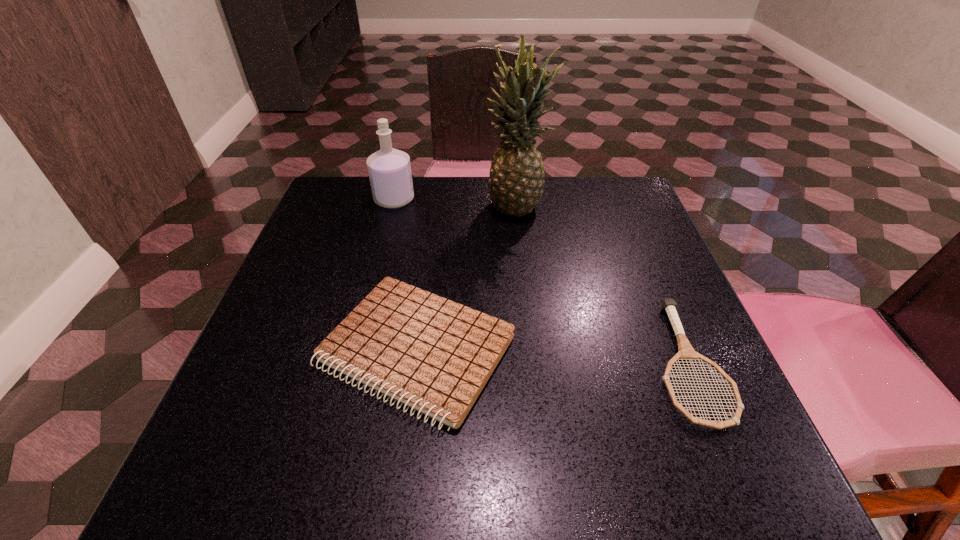
You are a GUI agent. You are given a task and a screenshot of the screen. Output one action in this format:
    pyautogui.click(x=<x>, y=<y>)
    Task: Click on the vacant point located between the rightmost object and the pineapple
    
    Given the screenshot: What is the action you would take?
    pyautogui.click(x=602, y=284)

Locate which object ranks third in proximity to the tennis racket. Please provide its 2D coordinates. Your answer should be formatted as a tuple, i.e. [(x, y)], where the tuple contains the x and y coordinates of a point satisfying the conditions above.

[(389, 169)]

This screenshot has width=960, height=540. In order to click on the second closest object relative to the notebook in this screenshot , I will do `click(686, 352)`.

The width and height of the screenshot is (960, 540). I want to click on free spot that satisfies the following two spatial constraints: 1. on the front side of the notebook; 2. on the right side of the rightmost object, so click(x=415, y=363).

Locate an element on the screen. The image size is (960, 540). free spot that satisfies the following two spatial constraints: 1. on the front side of the perfume; 2. on the right side of the rightmost object is located at coordinates (352, 363).

Image resolution: width=960 pixels, height=540 pixels. I want to click on vacant region that satisfies the following two spatial constraints: 1. on the front side of the perfume; 2. on the right side of the tallest object, so click(x=393, y=205).

I want to click on free location that satisfies the following two spatial constraints: 1. on the front side of the rightmost object; 2. on the right side of the perfume, so click(352, 363).

Where is `vacant point that satisfies the following two spatial constraints: 1. on the front side of the notebook; 2. on the left side of the rightmost object`? The width and height of the screenshot is (960, 540). vacant point that satisfies the following two spatial constraints: 1. on the front side of the notebook; 2. on the left side of the rightmost object is located at coordinates (415, 363).